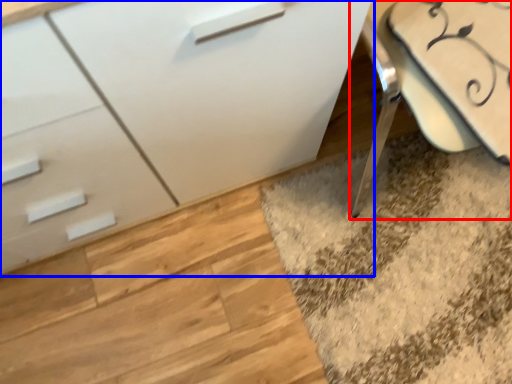
Question: Which of the following is the farthest to the observer, swivel chair (highlighted by a red box) or chest of drawers (highlighted by a blue box)?

Choices:
 (A) swivel chair
 (B) chest of drawers

Answer: (A)